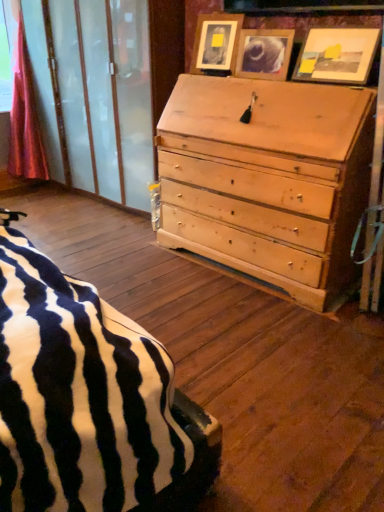
The height and width of the screenshot is (512, 384). Describe the element at coordinates (25, 118) in the screenshot. I see `pink satin curtain at left` at that location.

Locate an element on the screen. wooden picture frame at upper center, placed as the first picture frame when sorted from left to right is located at coordinates (216, 42).

Is matte wooden picture frame at upper right, which ranks as the 3th picture frame in left-to-right order, outside of pink satin curtain at left?

Absolutely, matte wooden picture frame at upper right, which ranks as the 3th picture frame in left-to-right order, is external to pink satin curtain at left.

Considering the positions of points (301, 50) and (13, 72), is point (301, 50) closer to camera compared to point (13, 72)?

Yes, it is.

From a real-world perspective, which object rests below the other?

pink satin curtain at left, from a real-world perspective.

Considering the relative positions of matte wooden picture frame at upper right, acting as the 1th picture frame starting from the right, and pink satin curtain at left in the image provided, is matte wooden picture frame at upper right, acting as the 1th picture frame starting from the right, to the left of pink satin curtain at left from the viewer's perspective?

In fact, matte wooden picture frame at upper right, acting as the 1th picture frame starting from the right, is to the right of pink satin curtain at left.

Is pink satin curtain at left placed right next to matte wooden picture frame at upper center, the second picture frame from the left?

pink satin curtain at left and matte wooden picture frame at upper center, the second picture frame from the left, are not in contact.

From the image's perspective, which object appears higher, pink satin curtain at left or matte wooden picture frame at upper center, the second picture frame positioned from the right?

pink satin curtain at left appears higher in the image.

Looking at this image, is pink satin curtain at left at the right side of matte wooden picture frame at upper center, the second picture frame from the left?

No, pink satin curtain at left is not to the right of matte wooden picture frame at upper center, the second picture frame from the left.

Is pink satin curtain at left not within matte wooden picture frame at upper center, the second picture frame from the left?

pink satin curtain at left lies outside matte wooden picture frame at upper center, the second picture frame from the left,'s area.

Which is correct: matte wooden picture frame at upper center, the second picture frame positioned from the right, is inside matte wooden picture frame at upper right, acting as the 1th picture frame starting from the right, or outside of it?

matte wooden picture frame at upper center, the second picture frame positioned from the right, is spatially situated outside matte wooden picture frame at upper right, acting as the 1th picture frame starting from the right.

From the picture: Considering the sizes of objects matte wooden picture frame at upper center, the second picture frame positioned from the right, and matte wooden picture frame at upper right, acting as the 1th picture frame starting from the right, in the image provided, who is smaller, matte wooden picture frame at upper center, the second picture frame positioned from the right, or matte wooden picture frame at upper right, acting as the 1th picture frame starting from the right,?

matte wooden picture frame at upper center, the second picture frame positioned from the right, is smaller.

Could you tell me if matte wooden picture frame at upper center, the second picture frame from the left, is turned towards matte wooden picture frame at upper right, which ranks as the 3th picture frame in left-to-right order?

No, matte wooden picture frame at upper center, the second picture frame from the left, is not oriented towards matte wooden picture frame at upper right, which ranks as the 3th picture frame in left-to-right order.

In the scene shown: Does matte wooden picture frame at upper center, the second picture frame from the left, touch matte wooden picture frame at upper right, which ranks as the 3th picture frame in left-to-right order?

They are not placed beside each other.

Is point (208, 61) farther from camera compared to point (244, 48)?

Yes, it is behind point (244, 48).

From the image's perspective, is wooden picture frame at upper center, the third picture frame when ordered from right to left, located beneath matte wooden picture frame at upper center, the second picture frame from the left?

No.

Considering the sizes of objects wooden picture frame at upper center, the third picture frame when ordered from right to left, and matte wooden picture frame at upper center, the second picture frame positioned from the right, in the image provided, who is thinner, wooden picture frame at upper center, the third picture frame when ordered from right to left, or matte wooden picture frame at upper center, the second picture frame positioned from the right,?

Thinner between the two is matte wooden picture frame at upper center, the second picture frame positioned from the right.

Based on the photo, from a real-world perspective, is wooden picture frame at upper center, the third picture frame when ordered from right to left, over matte wooden picture frame at upper center, the second picture frame positioned from the right?

Yes, from a real-world perspective, wooden picture frame at upper center, the third picture frame when ordered from right to left, is over matte wooden picture frame at upper center, the second picture frame positioned from the right

Is matte wooden picture frame at upper center, the second picture frame positioned from the right, far from wooden picture frame at upper center, placed as the first picture frame when sorted from left to right?

No, matte wooden picture frame at upper center, the second picture frame positioned from the right, is in close proximity to wooden picture frame at upper center, placed as the first picture frame when sorted from left to right.

Looking at the image, does matte wooden picture frame at upper center, the second picture frame positioned from the right, seem bigger or smaller compared to wooden picture frame at upper center, placed as the first picture frame when sorted from left to right?

matte wooden picture frame at upper center, the second picture frame positioned from the right, is smaller than wooden picture frame at upper center, placed as the first picture frame when sorted from left to right.

Is matte wooden picture frame at upper center, the second picture frame positioned from the right, looking in the opposite direction of wooden picture frame at upper center, placed as the first picture frame when sorted from left to right?

No, matte wooden picture frame at upper center, the second picture frame positioned from the right,'s orientation is not away from wooden picture frame at upper center, placed as the first picture frame when sorted from left to right.

Are pink satin curtain at left and matte wooden picture frame at upper right, acting as the 1th picture frame starting from the right, far apart?

Yes.

From the picture: Could you measure the distance between pink satin curtain at left and matte wooden picture frame at upper right, acting as the 1th picture frame starting from the right?

pink satin curtain at left and matte wooden picture frame at upper right, acting as the 1th picture frame starting from the right, are 9.59 feet apart from each other.

Which is in front, pink satin curtain at left or matte wooden picture frame at upper right, which ranks as the 3th picture frame in left-to-right order?

matte wooden picture frame at upper right, which ranks as the 3th picture frame in left-to-right order, is closer to the camera.

Starting from the pink satin curtain at left, which picture frame is the 1st one to the right? Please provide its 2D coordinates.

[(216, 42)]

Does wooden picture frame at upper center, placed as the first picture frame when sorted from left to right, have a greater width compared to pink satin curtain at left?

No, wooden picture frame at upper center, placed as the first picture frame when sorted from left to right, is not wider than pink satin curtain at left.

Does wooden picture frame at upper center, placed as the first picture frame when sorted from left to right, have a lesser height compared to pink satin curtain at left?

Yes.

From a real-world perspective, is wooden picture frame at upper center, placed as the first picture frame when sorted from left to right, below pink satin curtain at left?

No, from a real-world perspective, wooden picture frame at upper center, placed as the first picture frame when sorted from left to right, is not beneath pink satin curtain at left.

At what (x,y) coordinates should I click in order to perform the action: click on curtain lying on the left of matte wooden picture frame at upper right, acting as the 1th picture frame starting from the right. Please return your answer as a coordinate pair (x, y). The width and height of the screenshot is (384, 512). Looking at the image, I should click on (25, 118).

Find the location of a particular element. This screenshot has width=384, height=512. the 2nd picture frame to the right of the pink satin curtain at left, counting from the anchor's position is located at coordinates (264, 53).

Based on their spatial positions, is matte wooden picture frame at upper right, acting as the 1th picture frame starting from the right, or matte wooden picture frame at upper center, the second picture frame positioned from the right, further from pink satin curtain at left?

The object further to pink satin curtain at left is matte wooden picture frame at upper right, acting as the 1th picture frame starting from the right.

Looking at the image, which one is located further to matte wooden picture frame at upper right, which ranks as the 3th picture frame in left-to-right order, wooden picture frame at upper center, placed as the first picture frame when sorted from left to right, or pink satin curtain at left?

The object further to matte wooden picture frame at upper right, which ranks as the 3th picture frame in left-to-right order, is pink satin curtain at left.

From the image, which object appears to be nearer to pink satin curtain at left, matte wooden picture frame at upper center, the second picture frame positioned from the right, or wooden picture frame at upper center, the third picture frame when ordered from right to left?

The object closer to pink satin curtain at left is wooden picture frame at upper center, the third picture frame when ordered from right to left.

Estimate the real-world distances between objects in this image. Which object is closer to wooden picture frame at upper center, placed as the first picture frame when sorted from left to right, matte wooden picture frame at upper right, acting as the 1th picture frame starting from the right, or pink satin curtain at left?

Among the two, matte wooden picture frame at upper right, acting as the 1th picture frame starting from the right, is located nearer to wooden picture frame at upper center, placed as the first picture frame when sorted from left to right.

Consider the image. From the image, which object appears to be nearer to matte wooden picture frame at upper right, which ranks as the 3th picture frame in left-to-right order, pink satin curtain at left or matte wooden picture frame at upper center, the second picture frame positioned from the right?

matte wooden picture frame at upper center, the second picture frame positioned from the right, lies closer to matte wooden picture frame at upper right, which ranks as the 3th picture frame in left-to-right order, than the other object.

Estimate the real-world distances between objects in this image. Which object is further from matte wooden picture frame at upper right, which ranks as the 3th picture frame in left-to-right order, matte wooden picture frame at upper center, the second picture frame from the left, or wooden picture frame at upper center, the third picture frame when ordered from right to left?

The object further to matte wooden picture frame at upper right, which ranks as the 3th picture frame in left-to-right order, is wooden picture frame at upper center, the third picture frame when ordered from right to left.

Estimate the real-world distances between objects in this image. Which object is further from matte wooden picture frame at upper center, the second picture frame from the left, pink satin curtain at left or matte wooden picture frame at upper right, acting as the 1th picture frame starting from the right?

Based on the image, pink satin curtain at left appears to be further to matte wooden picture frame at upper center, the second picture frame from the left.

Based on the photo, estimate the real-world distances between objects in this image. Which object is closer to matte wooden picture frame at upper right, acting as the 1th picture frame starting from the right, wooden picture frame at upper center, placed as the first picture frame when sorted from left to right, or matte wooden picture frame at upper center, the second picture frame from the left?

Among the two, matte wooden picture frame at upper center, the second picture frame from the left, is located nearer to matte wooden picture frame at upper right, acting as the 1th picture frame starting from the right.

Locate an element on the screen. This screenshot has width=384, height=512. picture frame situated between wooden picture frame at upper center, the third picture frame when ordered from right to left, and matte wooden picture frame at upper right, acting as the 1th picture frame starting from the right, from left to right is located at coordinates (264, 53).

The width and height of the screenshot is (384, 512). I want to click on picture frame located between pink satin curtain at left and matte wooden picture frame at upper center, the second picture frame from the left, in the left-right direction, so click(216, 42).